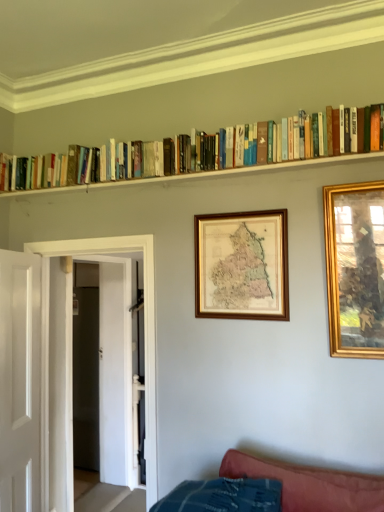
The image size is (384, 512). I want to click on vacant space situated above wooden books at upper center (from a real-world perspective), so click(x=124, y=183).